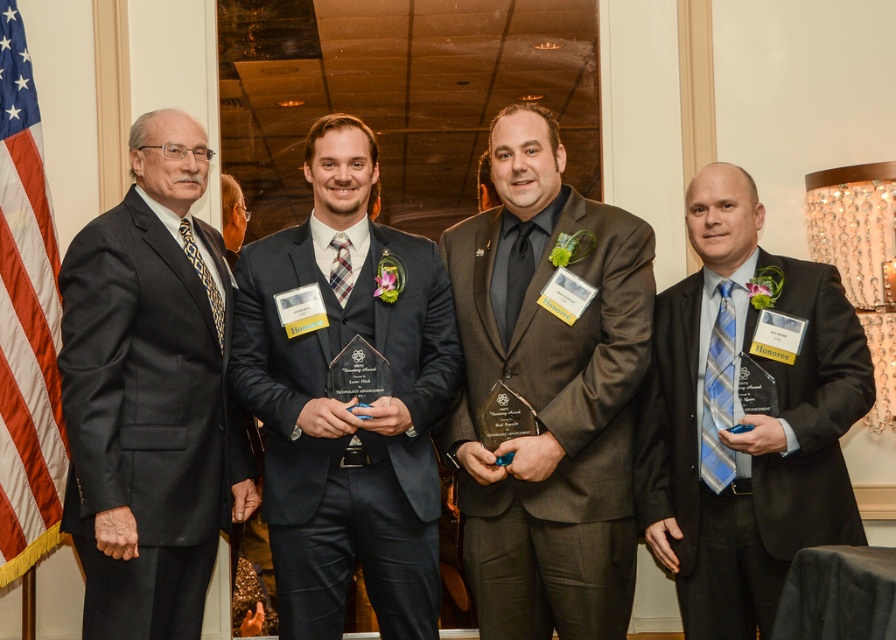
From the picture: You are a photographer adjusting your camera settings for the group photo. You notice two points marked in the scene at coordinates point (784, 492) and point (351, 285). Which point is nearer to your camera lens?

Point (784, 492) is closer to the camera than point (351, 285).

You are a photographer adjusting the camera to capture a closeup of the black satin tie at center and the plaid silk tie at center. The camera has a maximum focus range of 20 inches. Will you be able to focus on both ties at the same time?

The black satin tie at center and plaid silk tie at center are 23.33 inches apart from each other, which exceeds the camera maximum focus range of 20 inches. Therefore, you cannot focus on both ties simultaneously.